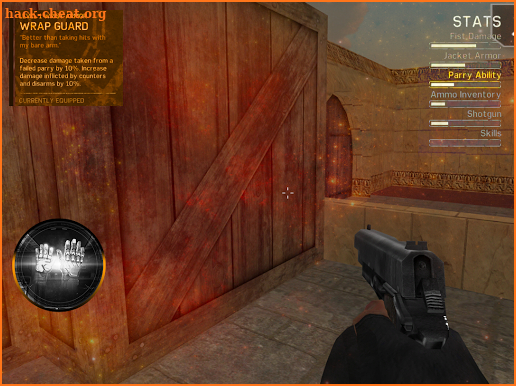
This screenshot has width=516, height=386. I want to click on ceiling, so (380, 38).